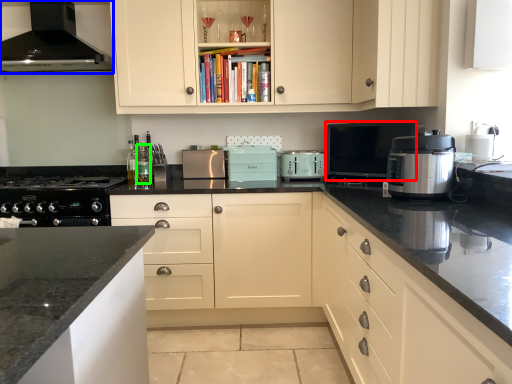
Question: Based on their relative distances, which object is farther from kitchen appliance (highlighted by a red box)? Choose from home appliance (highlighted by a blue box) and bottle (highlighted by a green box).

Choices:
 (A) home appliance
 (B) bottle

Answer: (A)